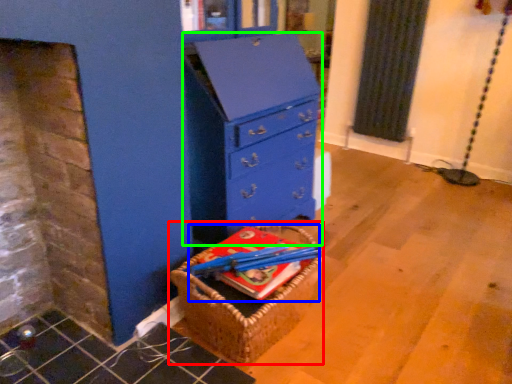
Question: Which object is positioned farthest from basket (highlighted by a red box)? Select from book (highlighted by a blue box) and chest of drawers (highlighted by a green box).

Choices:
 (A) book
 (B) chest of drawers

Answer: (B)